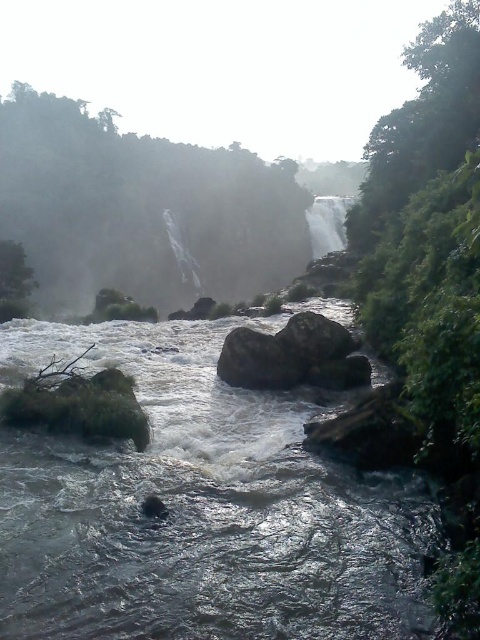
Question: Which object is farther from the camera taking this photo?

Choices:
 (A) translucent white water at center
 (B) gray rough rock at center

Answer: (A)

Question: Which is farther from the smooth rock at center?

Choices:
 (A) smooth gray rock at center
 (B) gray rough rock at center
 (C) translucent white water at center
 (D) dark gray stone stream at center

Answer: (C)

Question: Can you confirm if smooth gray rock at center is positioned to the left of smooth rock at center?

Choices:
 (A) no
 (B) yes

Answer: (B)

Question: Is dark gray stone stream at center positioned before smooth rock at center?

Choices:
 (A) no
 (B) yes

Answer: (B)

Question: Can you confirm if gray rough rock at center is positioned above smooth rock at center?

Choices:
 (A) no
 (B) yes

Answer: (B)

Question: Which object appears farthest from the camera in this image?

Choices:
 (A) smooth gray rock at center
 (B) dark gray stone stream at center

Answer: (A)